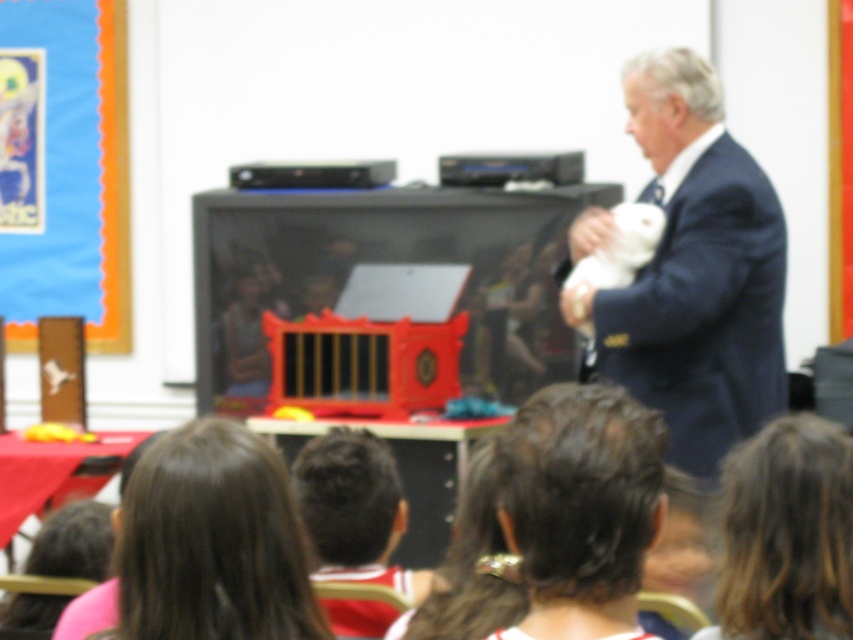
You are a photographer in the classroom and want to capture a photo of the brown hair at lower left and brown hair at lower right. Which hair has a wider width?

The brown hair at lower left has a wider width than the brown hair at lower right.

Consider the image. You are a student sitting in the classroom facing the puppet theater. You notice two people with brown hair at lower left and brown hair at lower right. Which one is closer to your left side?

The brown hair at lower left is closer to your left side because it is positioned to the left of the brown hair at lower right.

You are a student sitting in the classroom and want to see both the dark blue suit at right and the brown hair at lower left. Which object will appear closer to you?

The dark blue suit at right is closer to you since it is further to the viewer than the brown hair at lower left.